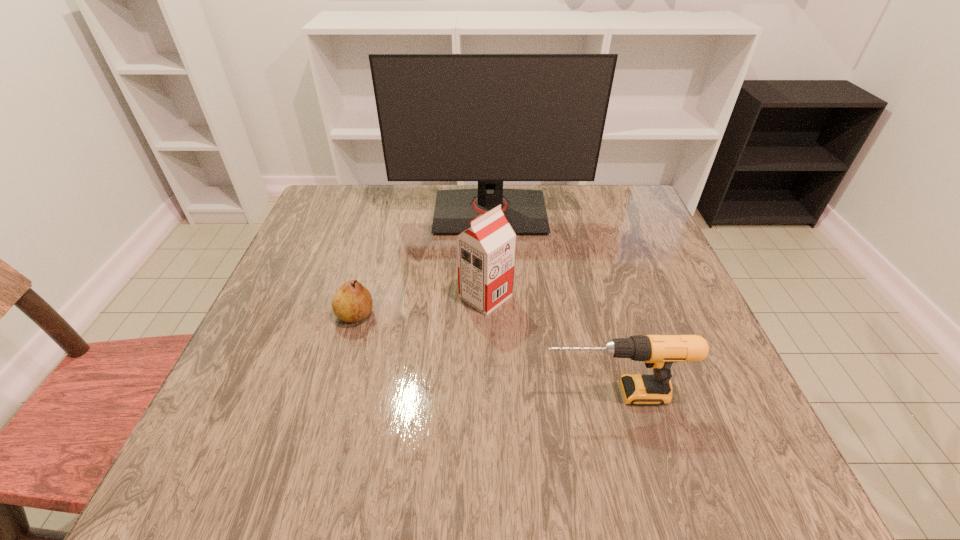
Identify the location of empty space between the nearest object and the soya milk. This screenshot has width=960, height=540. (549, 345).

Where is `vacant space that's between the shortest object and the farthest object`? vacant space that's between the shortest object and the farthest object is located at coordinates (423, 264).

Locate an element on the screen. object that is the second closest one to the pear is located at coordinates (490, 118).

The height and width of the screenshot is (540, 960). In order to click on object that stands as the second closest to the drill in this screenshot , I will do (352, 302).